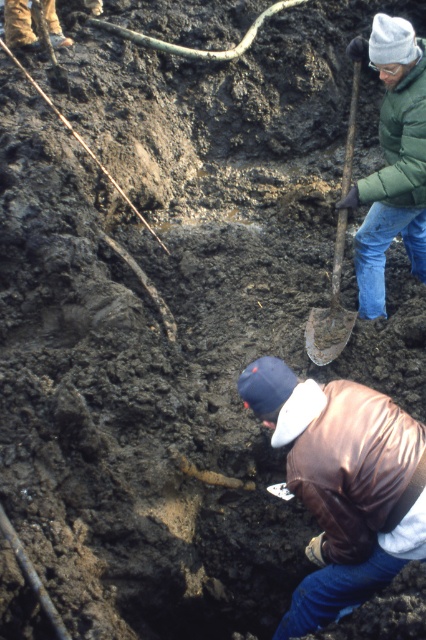
Question: Observing the image, what is the correct spatial positioning of brown leather jacket at lower center in reference to rusty metal shovel at upper right?

Choices:
 (A) left
 (B) right

Answer: (A)

Question: Which point is farther to the camera?

Choices:
 (A) (305, 337)
 (B) (374, 26)
 (C) (357, 460)
 (D) (414, 173)

Answer: (A)

Question: Among these objects, which one is farthest from the camera?

Choices:
 (A) green fuzzy jacket at upper right
 (B) green puffy jacket at upper right
 (C) rusty metal shovel at upper right

Answer: (C)

Question: Can you confirm if green puffy jacket at upper right is positioned to the right of rusty metal shovel at upper right?

Choices:
 (A) yes
 (B) no

Answer: (A)

Question: Is brown leather jacket at lower center positioned behind rusty metal shovel at upper right?

Choices:
 (A) no
 (B) yes

Answer: (A)

Question: Which object appears farthest from the camera in this image?

Choices:
 (A) rusty metal shovel at upper right
 (B) brown leather jacket at lower center

Answer: (A)